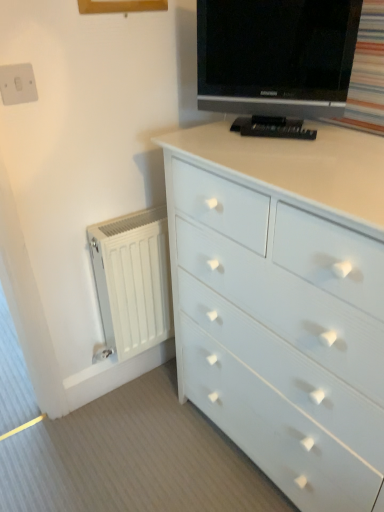
Question: From the image's perspective, is white plastic switch at upper left above black glossy tv at upper center?

Choices:
 (A) yes
 (B) no

Answer: (B)

Question: Does white plastic switch at upper left have a greater width compared to black glossy tv at upper center?

Choices:
 (A) no
 (B) yes

Answer: (A)

Question: Is white plastic switch at upper left completely or partially outside of black glossy tv at upper center?

Choices:
 (A) yes
 (B) no

Answer: (A)

Question: Is the depth of white plastic switch at upper left less than that of black glossy tv at upper center?

Choices:
 (A) no
 (B) yes

Answer: (A)

Question: Considering the relative sizes of white plastic switch at upper left and black glossy tv at upper center in the image provided, is white plastic switch at upper left smaller than black glossy tv at upper center?

Choices:
 (A) no
 (B) yes

Answer: (B)

Question: In terms of height, does white matte radiator at left look taller or shorter compared to white plastic switch at upper left?

Choices:
 (A) short
 (B) tall

Answer: (B)

Question: From a real-world perspective, is white matte radiator at left above or below white plastic switch at upper left?

Choices:
 (A) above
 (B) below

Answer: (B)

Question: In terms of size, does white matte radiator at left appear bigger or smaller than white plastic switch at upper left?

Choices:
 (A) small
 (B) big

Answer: (B)

Question: Is white matte radiator at left wider or thinner than white plastic switch at upper left?

Choices:
 (A) wide
 (B) thin

Answer: (A)

Question: From a real-world perspective, is black glossy tv at upper center positioned above or below white painted wood chest of drawers at center?

Choices:
 (A) below
 (B) above

Answer: (B)

Question: Looking at their shapes, would you say black glossy tv at upper center is wider or thinner than white painted wood chest of drawers at center?

Choices:
 (A) thin
 (B) wide

Answer: (A)

Question: Based on their positions, is black glossy tv at upper center located to the left or right of white painted wood chest of drawers at center?

Choices:
 (A) left
 (B) right

Answer: (A)

Question: Do you think black glossy tv at upper center is within white painted wood chest of drawers at center, or outside of it?

Choices:
 (A) outside
 (B) inside

Answer: (A)

Question: Visually, is white plastic switch at upper left positioned to the left or to the right of black glossy tv at upper center?

Choices:
 (A) left
 (B) right

Answer: (A)

Question: Is white plastic switch at upper left in front of or behind black glossy tv at upper center in the image?

Choices:
 (A) front
 (B) behind

Answer: (B)